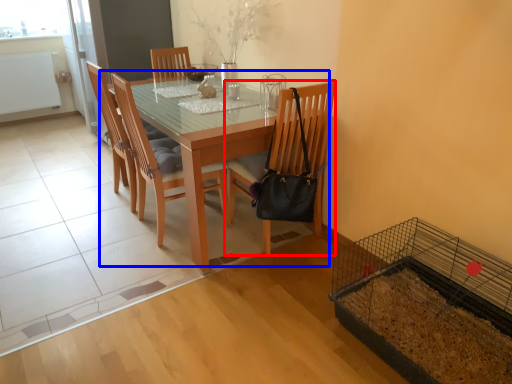
Question: Which object is further to the camera taking this photo, chair (highlighted by a red box) or kitchen & dining room table (highlighted by a blue box)?

Choices:
 (A) chair
 (B) kitchen & dining room table

Answer: (A)